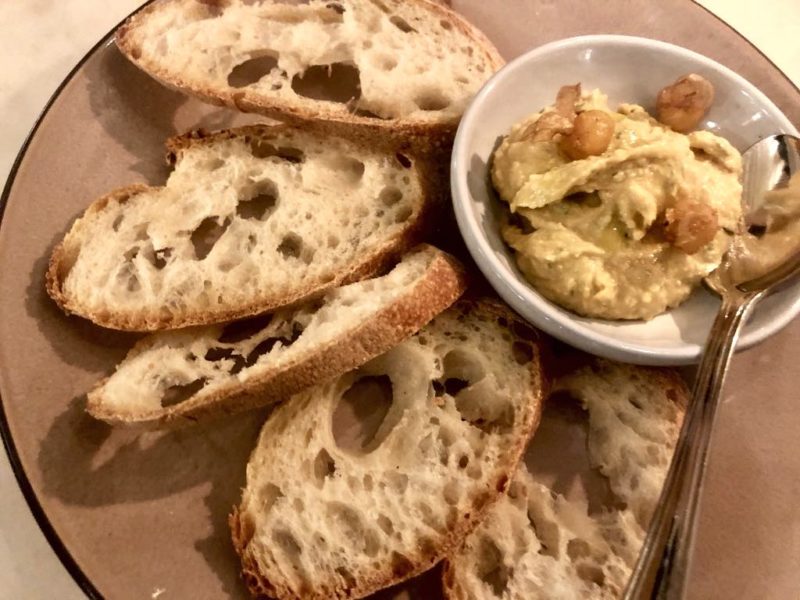
This screenshot has width=800, height=600. Find the location of `bowl`. bowl is located at coordinates (682, 314).